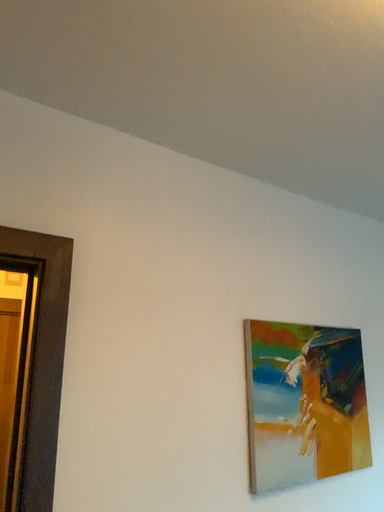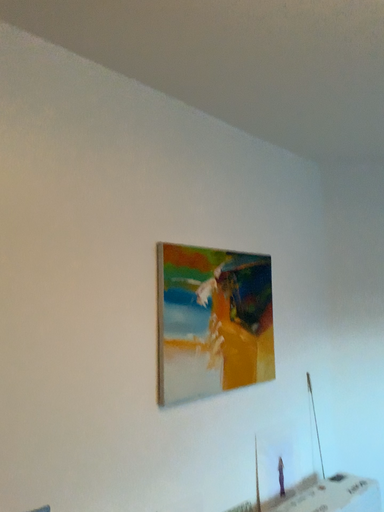
Question: Which way did the camera rotate in the video?

Choices:
 (A) rotated right
 (B) rotated left

Answer: (A)